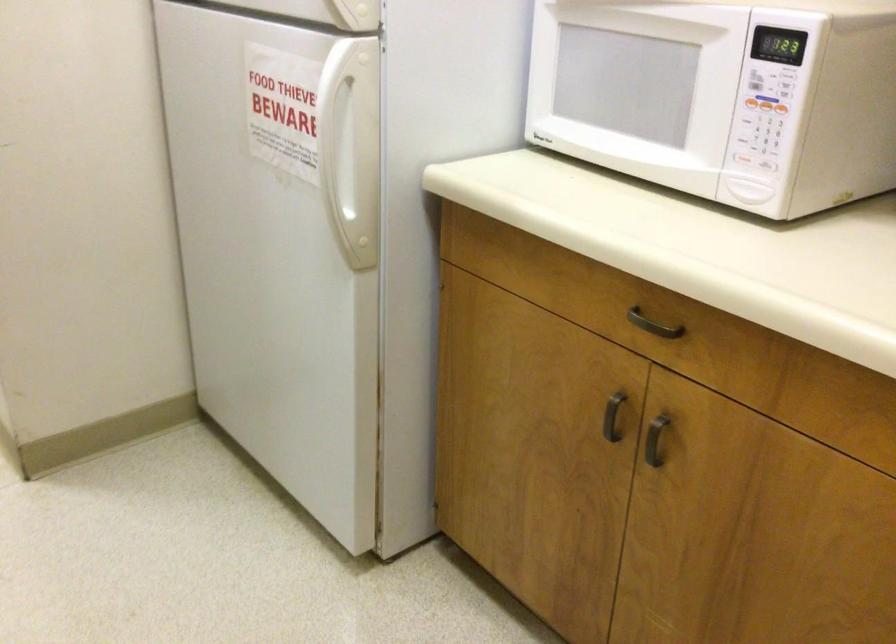
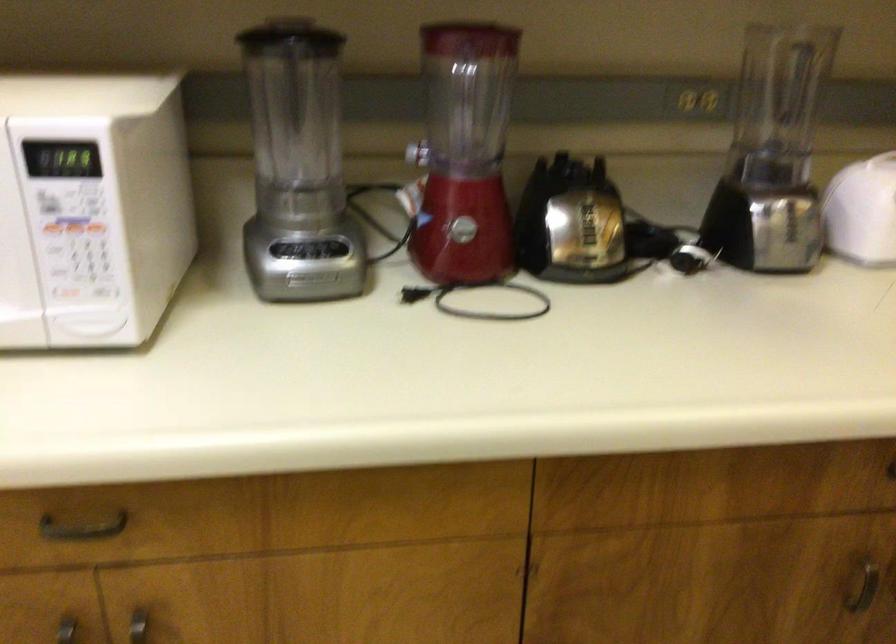
The point at (761, 116) is marked in the first image. Where is the corresponding point in the second image?

(74, 242)